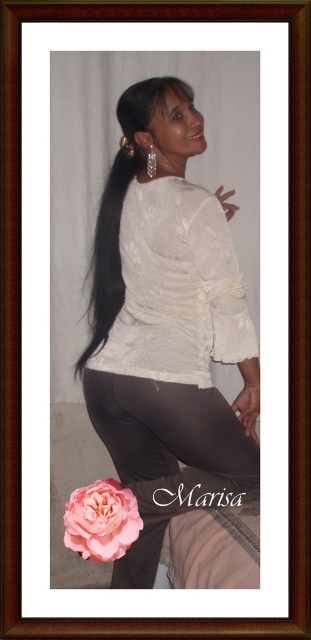
You are an interior designer working on a project. You need to place a small plant pot in the scene. The plant pot is 10 cm wide. Where should you place it so that it doesn not interfere with the matte black leggings at lower center?

The matte black leggings at lower center is located at point (167,456). To avoid interference, place the plant pot away from this coordinate. For example, placing it near the pink rose graphic in the bottom left corner would keep it clear of the leggings.

You are a photographer adjusting the focus on your camera. You notice two points in the image at coordinates point (x=231, y=492) and point (x=86, y=548). Which point should you focus on first if you want to ensure the closer one is sharp?

Point (x=231, y=492) is further to the camera than point (x=86, y=548), so you should focus on point (x=231, y=492) first since it is closer to the camera.